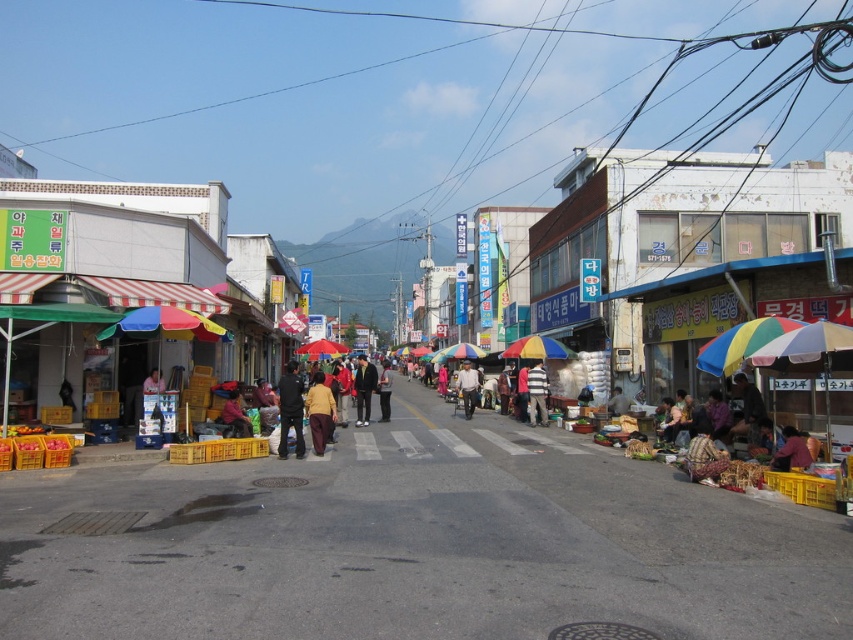
Question: Can you confirm if yellow fabric pants at center is thinner than brown fabric bag at center?

Choices:
 (A) no
 (B) yes

Answer: (B)

Question: Is rainbow fabric umbrella at center-right smaller than dark blue jeans at center?

Choices:
 (A) yes
 (B) no

Answer: (A)

Question: Considering the relative positions of dark gray pants at center and rainbow striped umbrella at center in the image provided, where is dark gray pants at center located with respect to rainbow striped umbrella at center?

Choices:
 (A) right
 (B) left

Answer: (B)

Question: Which point is farther to the camera?

Choices:
 (A) (531, 356)
 (B) (543, 368)

Answer: (A)

Question: Based on their relative distances, which object is farther from the dark gray pants at center?

Choices:
 (A) rainbow striped umbrella at center
 (B) matte black jacket at center

Answer: (A)

Question: Which object is closer to the camera taking this photo?

Choices:
 (A) black fabric jacket at center
 (B) red fabric headscarf at center
 (C) yellow fabric pants at center
 (D) dark blue jeans at center

Answer: (D)